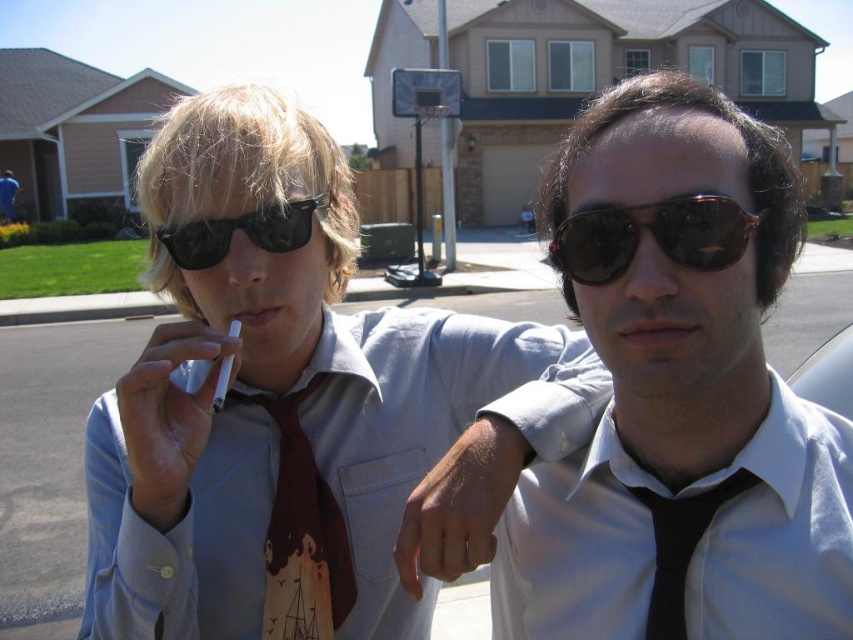
How far apart are light blue cotton dress shirt at center and matte skin at center?

A distance of 21.13 inches exists between light blue cotton dress shirt at center and matte skin at center.

Does light blue cotton dress shirt at center have a lesser width compared to matte skin at center?

In fact, light blue cotton dress shirt at center might be wider than matte skin at center.

Between point (111, 525) and point (672, 324), which one is positioned behind?

Positioned behind is point (111, 525).

You are a GUI agent. You are given a task and a screenshot of the screen. Output one action in this format:
    pyautogui.click(x=<x>, y=<y>)
    Task: Click on the light blue cotton dress shirt at center
    This screenshot has width=853, height=640.
    Given the screenshot: What is the action you would take?
    pyautogui.click(x=328, y=468)

Who is taller, light blue cotton dress shirt at center or black reflective sunglasses at upper left?

Standing taller between the two is light blue cotton dress shirt at center.

Who is higher up, light blue cotton dress shirt at center or black reflective sunglasses at upper left?

black reflective sunglasses at upper left

Who is more forward, (x=383, y=496) or (x=212, y=241)?

Point (x=212, y=241)

I want to click on light blue cotton dress shirt at center, so click(328, 468).

Can you confirm if black matte tie at center is positioned to the left of black satin tie at center?

Yes, black matte tie at center is to the left of black satin tie at center.

You are a GUI agent. You are given a task and a screenshot of the screen. Output one action in this format:
    pyautogui.click(x=<x>, y=<y>)
    Task: Click on the black matte tie at center
    
    Given the screenshot: What is the action you would take?
    pyautogui.click(x=680, y=396)

Locate an element on the screen. black matte tie at center is located at coordinates (680, 396).